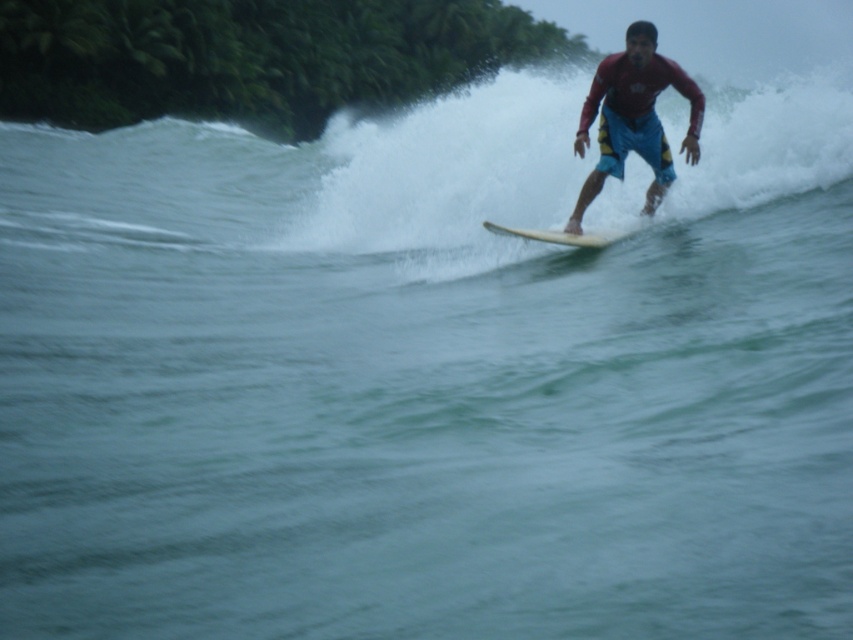
Question: Estimate the real-world distances between objects in this image. Which object is closer to the red matte surfboard at upper right?

Choices:
 (A) white smooth surfboard at center
 (B) white foamy wave at upper center

Answer: (A)

Question: Is white foamy wave at upper center above white smooth surfboard at center?

Choices:
 (A) yes
 (B) no

Answer: (A)

Question: Is white foamy wave at upper center wider than red matte surfboard at upper right?

Choices:
 (A) yes
 (B) no

Answer: (A)

Question: Which object appears closest to the camera in this image?

Choices:
 (A) red matte surfboard at upper right
 (B) white smooth surfboard at center

Answer: (A)

Question: Estimate the real-world distances between objects in this image. Which object is farther from the white smooth surfboard at center?

Choices:
 (A) red matte surfboard at upper right
 (B) white foamy wave at upper center

Answer: (B)

Question: Is white foamy wave at upper center wider than red matte surfboard at upper right?

Choices:
 (A) yes
 (B) no

Answer: (A)